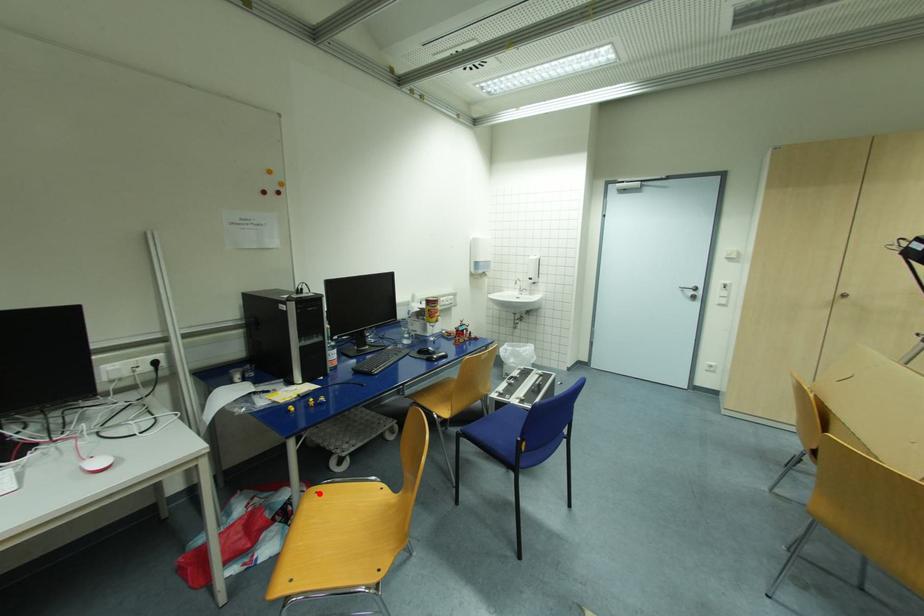
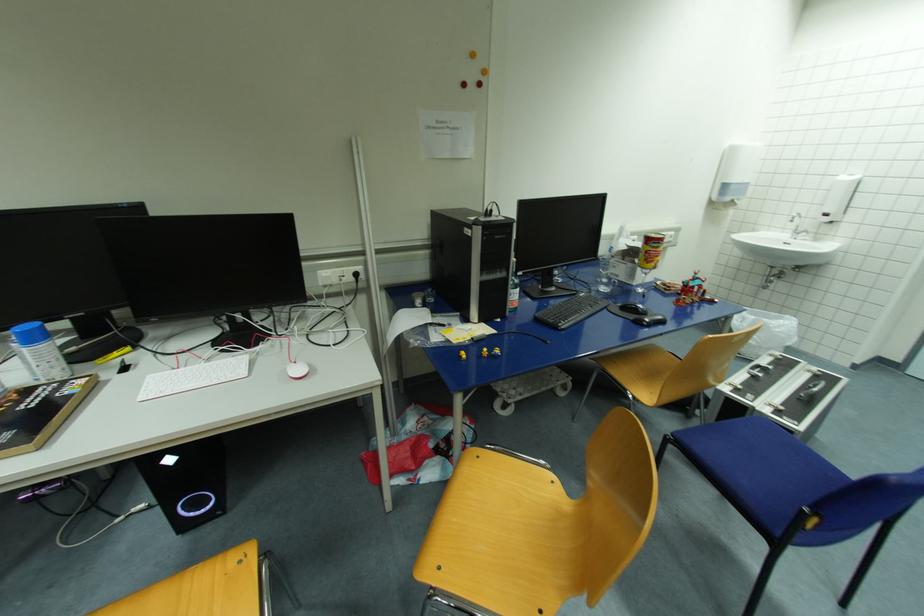
Where in the second image is the point corresponding to the highlighted location from the first image?

(481, 459)